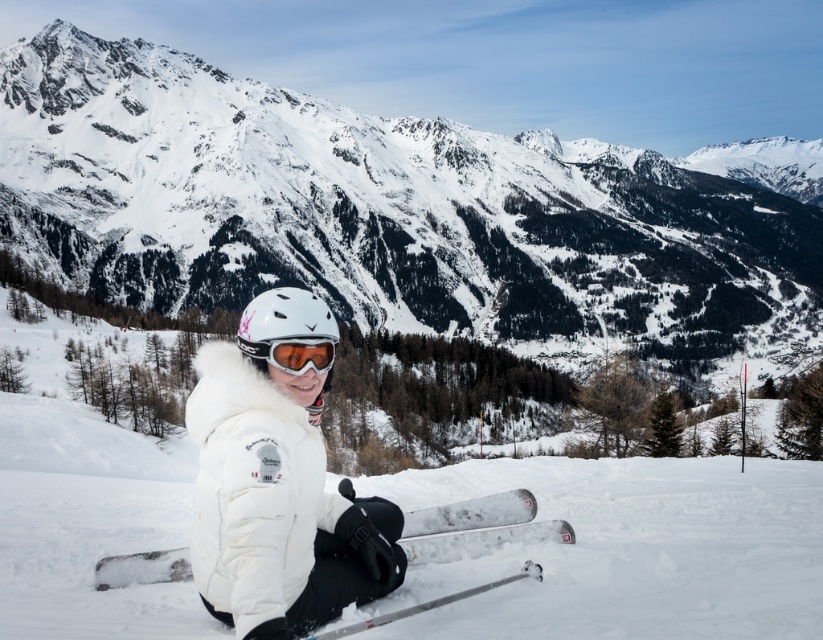
Does snowy mountain at center come behind orange reflective lens goggles at center?

Yes, snowy mountain at center is behind orange reflective lens goggles at center.

Who is lower down, snowy mountain at center or orange reflective lens goggles at center?

orange reflective lens goggles at center is lower down.

You are a GUI agent. You are given a task and a screenshot of the screen. Output one action in this format:
    pyautogui.click(x=<x>, y=<y>)
    Task: Click on the snowy mountain at center
    The height and width of the screenshot is (640, 823).
    Given the screenshot: What is the action you would take?
    pyautogui.click(x=401, y=212)

You are a GUI agent. You are given a task and a screenshot of the screen. Output one action in this format:
    pyautogui.click(x=<x>, y=<y>)
    Task: Click on the snowy mountain at center
    This screenshot has width=823, height=640.
    Given the screenshot: What is the action you would take?
    pyautogui.click(x=401, y=212)

Find the location of a particular element. The width and height of the screenshot is (823, 640). silver metallic ski at lower center is located at coordinates (477, 528).

Can you confirm if silver metallic ski at lower center is thinner than orange reflective lens goggles at center?

Incorrect, silver metallic ski at lower center's width is not less than orange reflective lens goggles at center's.

I want to click on silver metallic ski at lower center, so click(x=477, y=528).

Where is `silver metallic ski at lower center`? The width and height of the screenshot is (823, 640). silver metallic ski at lower center is located at coordinates (477, 528).

Is snowy mountain at center wider than silver metallic ski at lower center?

Indeed, snowy mountain at center has a greater width compared to silver metallic ski at lower center.

Can you confirm if snowy mountain at center is bigger than silver metallic ski at lower center?

Yes, snowy mountain at center is bigger than silver metallic ski at lower center.

Identify the location of snowy mountain at center. (401, 212).